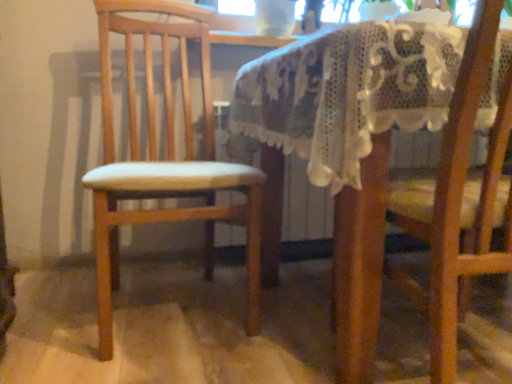
Question: Should I look upward or downward to see wooden chair at left, arranged as the 2th chair when viewed from the right?

Choices:
 (A) up
 (B) down

Answer: (A)

Question: Is wooden chair at right, the 1th chair viewed from the right, located outside wooden chair at left, arranged as the 2th chair when viewed from the right?

Choices:
 (A) no
 (B) yes

Answer: (B)

Question: Is wooden chair at right, the 1th chair viewed from the right, further to camera compared to wooden chair at left, arranged as the 2th chair when viewed from the right?

Choices:
 (A) yes
 (B) no

Answer: (B)

Question: Is wooden chair at left, the 1th chair from the left, at the back of wooden chair at right, the 1th chair viewed from the right?

Choices:
 (A) no
 (B) yes

Answer: (A)

Question: Is wooden chair at right, which appears as the 2th chair when viewed from the left, facing towards wooden chair at left, the 1th chair from the left?

Choices:
 (A) yes
 (B) no

Answer: (B)

Question: Considering the relative sizes of wooden chair at right, which appears as the 2th chair when viewed from the left, and wooden chair at left, the 1th chair from the left, in the image provided, is wooden chair at right, which appears as the 2th chair when viewed from the left, thinner than wooden chair at left, the 1th chair from the left,?

Choices:
 (A) yes
 (B) no

Answer: (A)

Question: Can you confirm if wooden chair at right, which appears as the 2th chair when viewed from the left, is shorter than wooden chair at left, arranged as the 2th chair when viewed from the right?

Choices:
 (A) no
 (B) yes

Answer: (B)

Question: From a real-world perspective, is wooden chair at left, the 1th chair from the left, on wooden chair at right, the 1th chair viewed from the right?

Choices:
 (A) no
 (B) yes

Answer: (B)

Question: Can you confirm if wooden chair at left, arranged as the 2th chair when viewed from the right, is positioned to the left of wooden chair at right, which appears as the 2th chair when viewed from the left?

Choices:
 (A) no
 (B) yes

Answer: (B)

Question: Considering the relative positions of wooden chair at left, the 1th chair from the left, and wooden chair at right, which appears as the 2th chair when viewed from the left, in the image provided, is wooden chair at left, the 1th chair from the left, behind wooden chair at right, which appears as the 2th chair when viewed from the left,?

Choices:
 (A) no
 (B) yes

Answer: (B)

Question: Is wooden chair at left, arranged as the 2th chair when viewed from the right, positioned with its back to wooden chair at right, which appears as the 2th chair when viewed from the left?

Choices:
 (A) no
 (B) yes

Answer: (A)

Question: Is wooden chair at left, arranged as the 2th chair when viewed from the right, thinner than wooden chair at right, the 1th chair viewed from the right?

Choices:
 (A) yes
 (B) no

Answer: (B)

Question: Does wooden chair at left, arranged as the 2th chair when viewed from the right, appear on the right side of wooden chair at right, the 1th chair viewed from the right?

Choices:
 (A) no
 (B) yes

Answer: (A)

Question: Considering the positions of wooden chair at left, the 1th chair from the left, and wooden chair at right, the 1th chair viewed from the right, in the image, is wooden chair at left, the 1th chair from the left, bigger or smaller than wooden chair at right, the 1th chair viewed from the right,?

Choices:
 (A) big
 (B) small

Answer: (A)